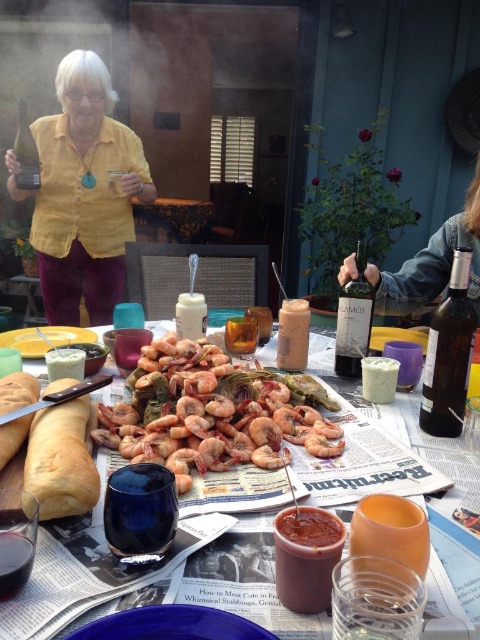
What is the position of the white matte platter at center?

The white matte platter at center is located at point (x=44, y=339).

You are a guest at this outdoor dining table. You want to grab the pink raw shrimp at center and the white matte platter at center. Which one is located to the right of the other?

The pink raw shrimp at center is to the right of the white matte platter at center.